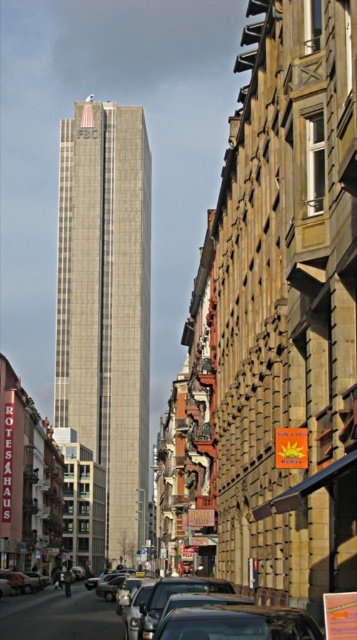
Question: Which point is closer to the camera?

Choices:
 (A) beige stone skyscraper at center
 (B) shiny silver car at lower center

Answer: (B)

Question: Is beige stone skyscraper at center further to the viewer compared to shiny silver car at lower center?

Choices:
 (A) yes
 (B) no

Answer: (A)

Question: Does beige stone skyscraper at center appear on the right side of shiny silver car at lower center?

Choices:
 (A) no
 (B) yes

Answer: (A)

Question: Which of the following is the farthest from the observer?

Choices:
 (A) (143, 627)
 (B) (101, 109)

Answer: (B)

Question: Does beige stone skyscraper at center have a greater width compared to shiny silver car at lower center?

Choices:
 (A) yes
 (B) no

Answer: (A)